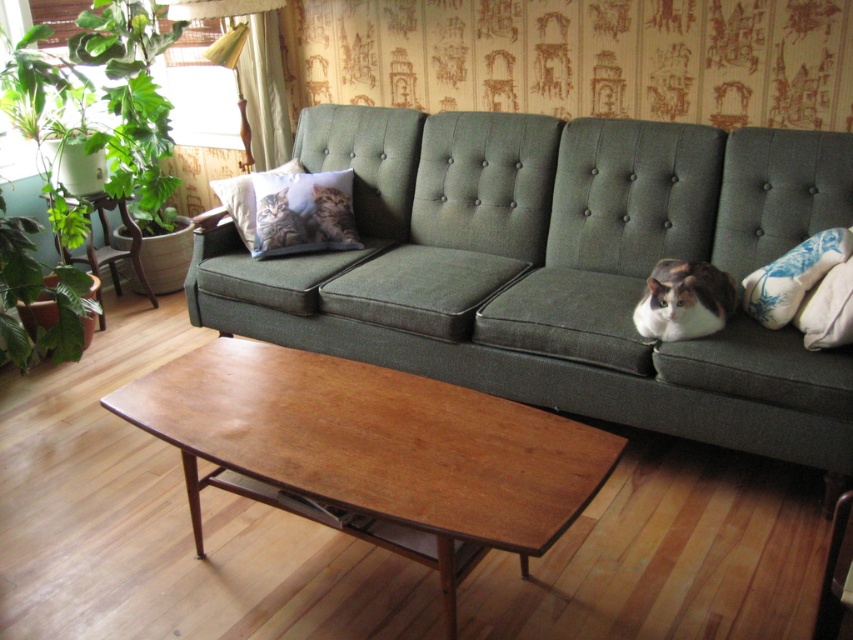
Question: In this image, where is blue floral pillow at right located relative to tabby fur pillow at center?

Choices:
 (A) below
 (B) above

Answer: (A)

Question: Does green fabric couch at center have a larger size compared to printed fabric pillow with cat image at center?

Choices:
 (A) no
 (B) yes

Answer: (B)

Question: Which point is farther to the camera?

Choices:
 (A) green leafy plant at left
 (B) printed fabric pillow with cat image at center
 (C) green fabric couch at center

Answer: (B)

Question: Can you confirm if wooden table at left is positioned to the right of printed fabric pillow with cat image at center?

Choices:
 (A) no
 (B) yes

Answer: (A)

Question: Which point is farther to the camera?

Choices:
 (A) (131, 228)
 (B) (323, 483)

Answer: (A)

Question: Which point is farther to the camera?

Choices:
 (A) wooden table at left
 (B) calico fur cat at center
 (C) tabby fur cat at center
 (D) soft gray fabric pillow at center

Answer: (A)